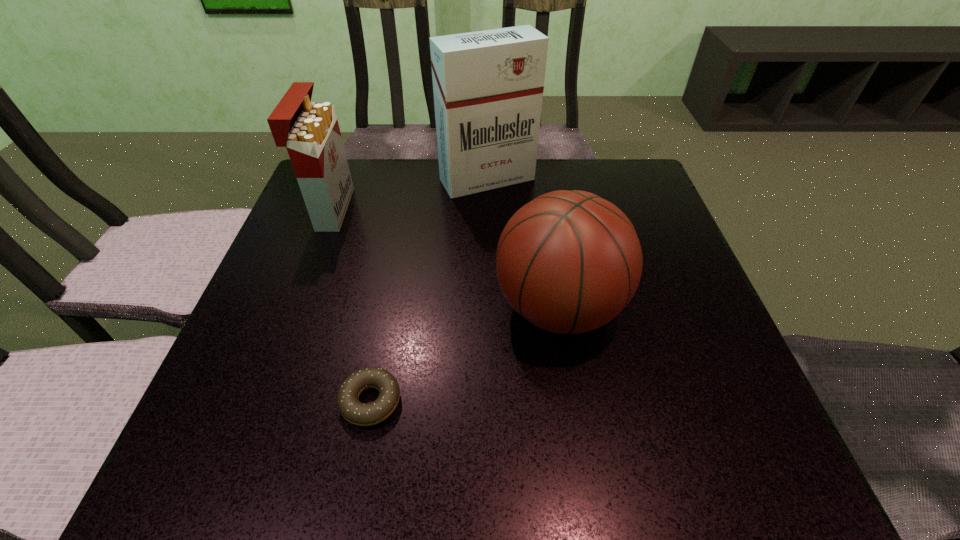
In order to click on vacant point located between the basketball and the shortest object in this screenshot , I will do `click(465, 354)`.

You are a GUI agent. You are given a task and a screenshot of the screen. Output one action in this format:
    pyautogui.click(x=<x>, y=<y>)
    Task: Click on the vacant region between the third farthest object and the doughnut
    Image resolution: width=960 pixels, height=540 pixels.
    Given the screenshot: What is the action you would take?
    pyautogui.click(x=465, y=354)

Locate an element on the screen. The image size is (960, 540). vacant point located between the third object from right to left and the basketball is located at coordinates (465, 354).

Locate an element on the screen. empty space that is in between the basketball and the leftmost object is located at coordinates (444, 258).

I want to click on free space between the tallest object and the third object from right to left, so click(429, 290).

At what (x,y) coordinates should I click in order to perform the action: click on empty space between the second nearest object and the leftmost object. Please return your answer as a coordinate pair (x, y). This screenshot has height=540, width=960. Looking at the image, I should click on (444, 258).

Locate an element on the screen. vacant space that is in between the leftmost object and the basketball is located at coordinates [444, 258].

This screenshot has width=960, height=540. What are the coordinates of `object that is the second nearest to the doughnut` in the screenshot? It's located at (310, 131).

Locate an element on the screen. object that ranks as the closest to the leftmost object is located at coordinates (488, 85).

Image resolution: width=960 pixels, height=540 pixels. What are the coordinates of `vacant space that satisfies the following two spatial constraints: 1. with the lid open on the shorter cigarette case; 2. on the right side of the doughnut` in the screenshot? It's located at (258, 401).